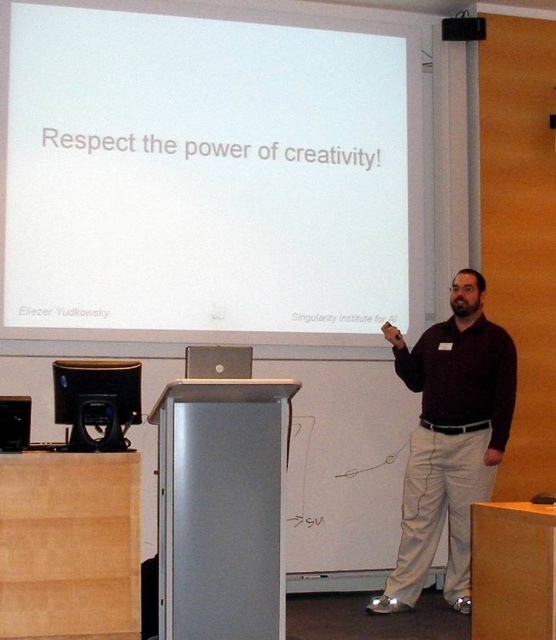
Question: In this image, where is white matte projection screen at upper center located relative to dark brown sweater at center?

Choices:
 (A) right
 (B) left

Answer: (B)

Question: Does dark brown sweater at center have a lesser width compared to matte black laptop at center?

Choices:
 (A) yes
 (B) no

Answer: (B)

Question: Is dark brown sweater at center thinner than matte black laptop at center?

Choices:
 (A) yes
 (B) no

Answer: (B)

Question: Which point is closer to the camera?

Choices:
 (A) (62, 256)
 (B) (421, 497)

Answer: (B)

Question: Which point is closer to the camera?

Choices:
 (A) matte black laptop at center
 (B) dark brown sweater at center

Answer: (B)

Question: Which object appears closest to the camera in this image?

Choices:
 (A) dark brown sweater at center
 (B) white matte projection screen at upper center
 (C) matte black laptop at center

Answer: (A)